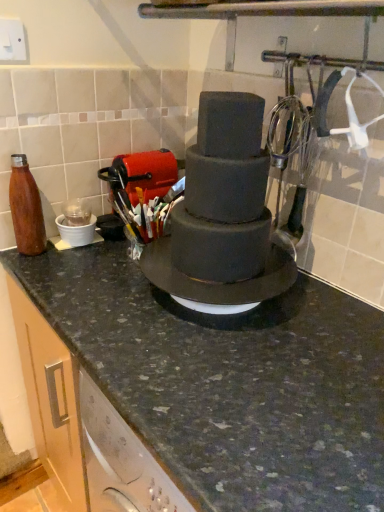
In order to click on smooth matte chocolate cake at center in this screenshot , I will do `click(224, 193)`.

Identify the location of matte brown bottle at left. (26, 208).

Who is bigger, granite countertop at center or matte brown bottle at left?

With larger size is granite countertop at center.

Is granite countertop at center completely or partially outside of matte brown bottle at left?

Yes, granite countertop at center is not within matte brown bottle at left.

Where is `countertop that is in front of the matte brown bottle at left`? The width and height of the screenshot is (384, 512). countertop that is in front of the matte brown bottle at left is located at coordinates (229, 381).

From the image's perspective, is granite countertop at center positioned above or below matte brown bottle at left?

granite countertop at center is situated lower than matte brown bottle at left in the image.

Could you tell me if granite countertop at center is facing smooth matte chocolate cake at center?

No, granite countertop at center is not oriented towards smooth matte chocolate cake at center.

From the image's perspective, between granite countertop at center and smooth matte chocolate cake at center, who is located below?

From the image's view, granite countertop at center is below.

Who is more distant, granite countertop at center or smooth matte chocolate cake at center?

smooth matte chocolate cake at center is further away from the camera.

Would you say granite countertop at center is outside smooth matte chocolate cake at center?

Indeed, granite countertop at center is completely outside smooth matte chocolate cake at center.

The image size is (384, 512). In order to click on bottle beneath the smooth matte chocolate cake at center (from a real-world perspective) in this screenshot , I will do `click(26, 208)`.

Are matte brown bottle at left and smooth matte chocolate cake at center far apart?

No, matte brown bottle at left is in close proximity to smooth matte chocolate cake at center.

Can you confirm if matte brown bottle at left is bigger than smooth matte chocolate cake at center?

Actually, matte brown bottle at left might be smaller than smooth matte chocolate cake at center.

Which of these two, smooth matte chocolate cake at center or matte brown bottle at left, stands taller?

With more height is smooth matte chocolate cake at center.

From the picture: Is smooth matte chocolate cake at center facing towards matte brown bottle at left?

No, smooth matte chocolate cake at center is not facing towards matte brown bottle at left.

Is smooth matte chocolate cake at center completely or partially outside of matte brown bottle at left?

Absolutely, smooth matte chocolate cake at center is external to matte brown bottle at left.

Does smooth matte chocolate cake at center touch matte brown bottle at left?

They are not placed beside each other.

Which of these two, matte brown bottle at left or granite countertop at center, is smaller?

matte brown bottle at left.

How different are the orientations of matte brown bottle at left and granite countertop at center in degrees?

They differ by 0.00147 degrees in their facing directions.

Is the surface of matte brown bottle at left in direct contact with granite countertop at center?

No, matte brown bottle at left is not touching granite countertop at center.

Considering the relative sizes of matte brown bottle at left and granite countertop at center in the image provided, is matte brown bottle at left taller than granite countertop at center?

No, matte brown bottle at left is not taller than granite countertop at center.

Is smooth matte chocolate cake at center shorter than granite countertop at center?

Yes, smooth matte chocolate cake at center is shorter than granite countertop at center.

Which object is closer to the camera taking this photo, smooth matte chocolate cake at center or granite countertop at center?

Positioned in front is granite countertop at center.

Is smooth matte chocolate cake at center wider or thinner than granite countertop at center?

smooth matte chocolate cake at center is thinner than granite countertop at center.

Is smooth matte chocolate cake at center in contact with granite countertop at center?

No, smooth matte chocolate cake at center is not touching granite countertop at center.

In order to click on countertop located underneath the matte brown bottle at left (from a real-world perspective) in this screenshot , I will do [x=229, y=381].

What are the coordinates of `countertop on the right side of smooth matte chocolate cake at center` in the screenshot? It's located at (229, 381).

Based on the photo, considering their positions, is matte brown bottle at left positioned closer to granite countertop at center than smooth matte chocolate cake at center?

Based on the image, smooth matte chocolate cake at center appears to be nearer to granite countertop at center.

Based on their spatial positions, is matte brown bottle at left or granite countertop at center further from smooth matte chocolate cake at center?

Among the two, matte brown bottle at left is located further to smooth matte chocolate cake at center.

Considering their positions, is granite countertop at center positioned closer to matte brown bottle at left than smooth matte chocolate cake at center?

smooth matte chocolate cake at center is closer to matte brown bottle at left.

Considering their positions, is smooth matte chocolate cake at center positioned closer to granite countertop at center than matte brown bottle at left?

smooth matte chocolate cake at center is positioned closer to the anchor granite countertop at center.

Which object lies nearer to the anchor point matte brown bottle at left, smooth matte chocolate cake at center or granite countertop at center?

Based on the image, smooth matte chocolate cake at center appears to be nearer to matte brown bottle at left.

When comparing their distances from smooth matte chocolate cake at center, does granite countertop at center or matte brown bottle at left seem closer?

granite countertop at center lies closer to smooth matte chocolate cake at center than the other object.

Where is `bottle between smooth matte chocolate cake at center and granite countertop at center in the vertical direction`? The image size is (384, 512). bottle between smooth matte chocolate cake at center and granite countertop at center in the vertical direction is located at coordinates (26, 208).